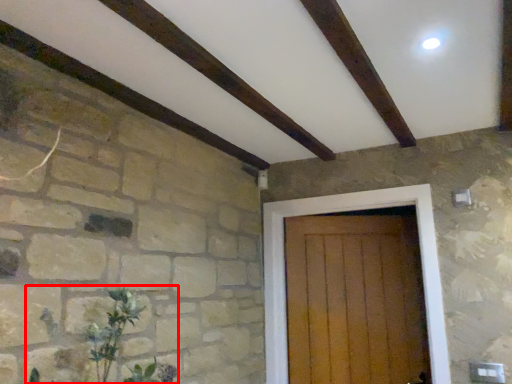
Question: From the image's perspective, what is the correct spatial positioning of plant (annotated by the red box) in reference to door?

Choices:
 (A) below
 (B) above

Answer: (B)